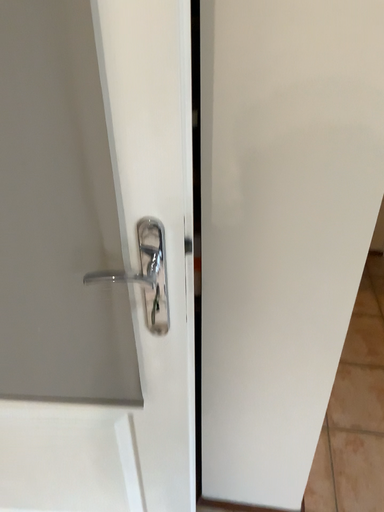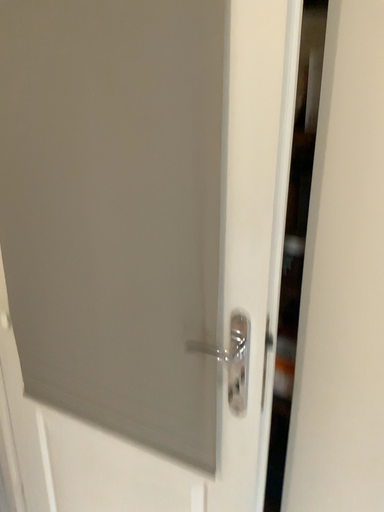
Question: Which way did the camera rotate in the video?

Choices:
 (A) rotated upward
 (B) rotated downward

Answer: (A)